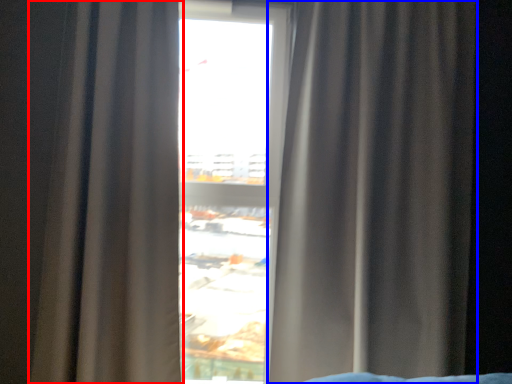
Question: Which point is further to the camera, curtain (highlighted by a red box) or curtain (highlighted by a blue box)?

Choices:
 (A) curtain
 (B) curtain

Answer: (B)